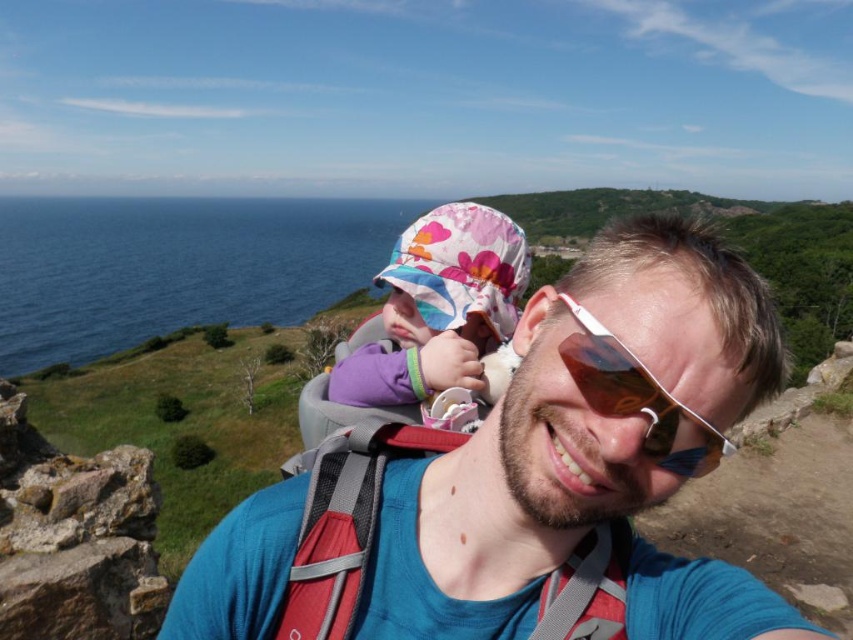
Based on the photo, looking at the scene, where is the floral fabric hat at center located in relation to the sunglasses at center?

The floral fabric hat at center is to the left of the sunglasses at center.

You are a photographer standing at the camera position. You want to take a closeup photo of the floral fabric hat at center. The camera lens has a minimum focusing distance of 2 feet. Can you take the photo without moving closer?

The floral fabric hat at center is 5.73 feet away from camera. Since the minimum focusing distance is 2 feet, the camera can focus on the floral fabric hat at center from this distance, so yes, you can take the closeup photo without moving closer.